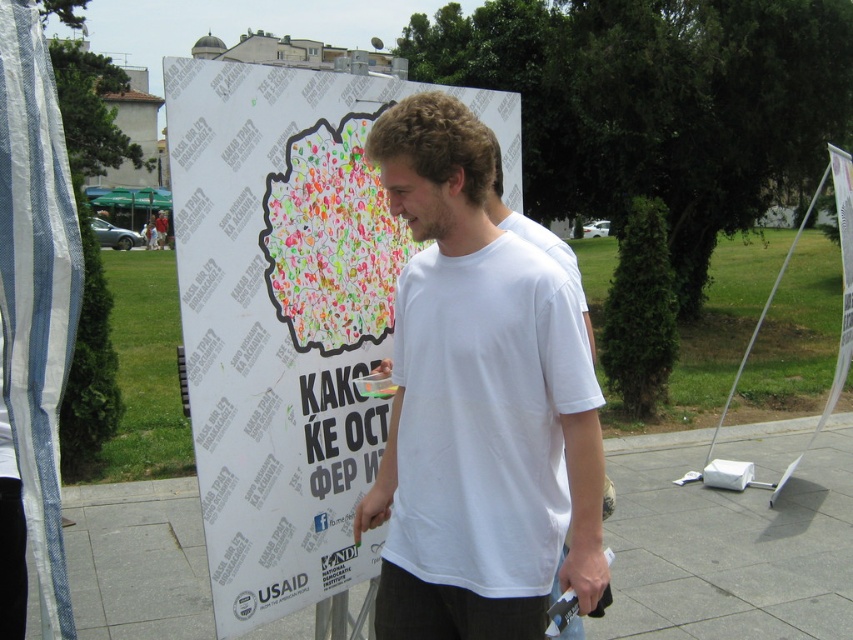
Question: Does white paper poster at center have a lesser width compared to white cotton t-shirt at center?

Choices:
 (A) yes
 (B) no

Answer: (B)

Question: Is the position of white paper poster at center more distant than that of gray concrete pavement at center?

Choices:
 (A) no
 (B) yes

Answer: (A)

Question: Which point is closer to the camera taking this photo?

Choices:
 (A) (287, 625)
 (B) (183, 134)
 (C) (474, 419)

Answer: (C)

Question: Can you confirm if white paper poster at center is wider than gray concrete pavement at center?

Choices:
 (A) no
 (B) yes

Answer: (A)

Question: Which object is closer to the camera taking this photo?

Choices:
 (A) gray concrete pavement at center
 (B) white paper poster at center
 (C) white cotton t-shirt at center

Answer: (C)

Question: Which point is farther from the camera taking this photo?

Choices:
 (A) (531, 376)
 (B) (328, 208)
 (C) (821, 576)

Answer: (C)